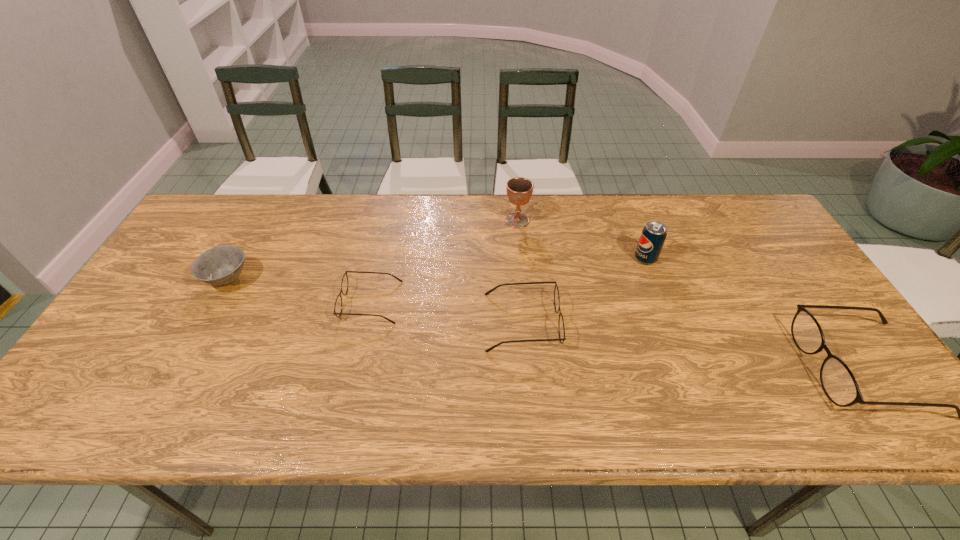
Identify the location of vacant space at the near left corner. The width and height of the screenshot is (960, 540). (126, 368).

Identify the location of vacant space that's between the leftmost object and the shortest spectacles. (300, 291).

You are a GUI agent. You are given a task and a screenshot of the screen. Output one action in this format:
    pyautogui.click(x=<x>, y=<y>)
    Task: Click on the free space between the second object from left to right and the farthest object
    This screenshot has height=540, width=960.
    Given the screenshot: What is the action you would take?
    pyautogui.click(x=444, y=261)

Where is `free space between the fifth object from right to left and the chalice`? This screenshot has height=540, width=960. free space between the fifth object from right to left and the chalice is located at coordinates (444, 261).

You are a GUI agent. You are given a task and a screenshot of the screen. Output one action in this format:
    pyautogui.click(x=<x>, y=<y>)
    Task: Click on the vacant space in between the fifth object from left to right and the fifth object from right to left
    This screenshot has height=540, width=960.
    Given the screenshot: What is the action you would take?
    pyautogui.click(x=508, y=280)

This screenshot has width=960, height=540. What are the coordinates of `vacant space in between the leftmost object and the second object from right to left` in the screenshot? It's located at (437, 269).

The height and width of the screenshot is (540, 960). Find the location of `empty space between the second shortest spectacles and the shortest spectacles`. empty space between the second shortest spectacles and the shortest spectacles is located at coordinates (446, 312).

This screenshot has height=540, width=960. In order to click on empty space between the farthest object and the bowl in this screenshot , I will do `click(372, 250)`.

Identify the location of vacant space that's between the chalice and the bowl. The height and width of the screenshot is (540, 960). (372, 250).

Choose which object is the second nearest neighbor to the second object from right to left. Please provide its 2D coordinates. Your answer should be formatted as a tuple, i.e. [(x, y)], where the tuple contains the x and y coordinates of a point satisfying the conditions above.

[(519, 190)]